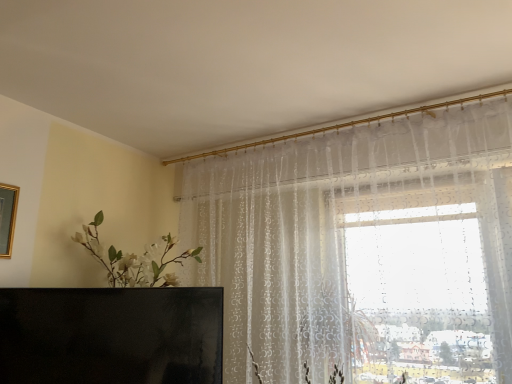
What do you see at coordinates (111, 335) in the screenshot?
I see `black glossy tv at lower left` at bounding box center [111, 335].

The image size is (512, 384). Identify the location of black glossy tv at lower left. (111, 335).

Measure the distance between point (191, 377) and camera.

Point (191, 377) is 2.14 meters from camera.

Image resolution: width=512 pixels, height=384 pixels. Describe the element at coordinates (7, 217) in the screenshot. I see `gold-framed mirror at upper left` at that location.

What is the approximate width of gold-framed mirror at upper left?

The width of gold-framed mirror at upper left is 1.58 inches.

The width and height of the screenshot is (512, 384). I want to click on gold-framed mirror at upper left, so click(x=7, y=217).

This screenshot has height=384, width=512. I want to click on black glossy tv at lower left, so click(111, 335).

Which is more to the right, black glossy tv at lower left or gold-framed mirror at upper left?

black glossy tv at lower left is more to the right.

Is black glossy tv at lower left behind gold-framed mirror at upper left?

No, it is not.

Does point (111, 377) lie in front of point (11, 212)?

That is True.

From the image's perspective, is black glossy tv at lower left below gold-framed mirror at upper left?

Indeed, from the image's perspective, black glossy tv at lower left is shown beneath gold-framed mirror at upper left.

From a real-world perspective, which object stands above the other?

In real-world perspective, gold-framed mirror at upper left is above.

Does black glossy tv at lower left have a greater width compared to gold-framed mirror at upper left?

Yes, black glossy tv at lower left is wider than gold-framed mirror at upper left.

Is black glossy tv at lower left taller than gold-framed mirror at upper left?

Indeed, black glossy tv at lower left has a greater height compared to gold-framed mirror at upper left.

Looking at the image, does black glossy tv at lower left seem bigger or smaller compared to gold-framed mirror at upper left?

black glossy tv at lower left is bigger than gold-framed mirror at upper left.

Can we say black glossy tv at lower left lies outside gold-framed mirror at upper left?

That's correct, black glossy tv at lower left is outside of gold-framed mirror at upper left.

Are black glossy tv at lower left and gold-framed mirror at upper left located far from each other?

No.

Is black glossy tv at lower left aimed at gold-framed mirror at upper left?

No, black glossy tv at lower left is not facing towards gold-framed mirror at upper left.

Where is `picture frame above the black glossy tv at lower left (from a real-world perspective)`? Image resolution: width=512 pixels, height=384 pixels. picture frame above the black glossy tv at lower left (from a real-world perspective) is located at coordinates click(x=7, y=217).

Which is more to the left, gold-framed mirror at upper left or black glossy tv at lower left?

Positioned to the left is gold-framed mirror at upper left.

Is gold-framed mirror at upper left positioned in front of black glossy tv at lower left?

No, it is not.

Between point (7, 246) and point (170, 369), which one is positioned in front?

The point (7, 246) is closer.

From the image's perspective, between gold-framed mirror at upper left and black glossy tv at lower left, which one is located above?

gold-framed mirror at upper left is shown above in the image.

From the picture: From a real-world perspective, is gold-framed mirror at upper left over black glossy tv at lower left?

Indeed, from a real-world perspective, gold-framed mirror at upper left stands above black glossy tv at lower left.

Can you confirm if gold-framed mirror at upper left is thinner than black glossy tv at lower left?

Indeed, gold-framed mirror at upper left has a lesser width compared to black glossy tv at lower left.

From their relative heights in the image, would you say gold-framed mirror at upper left is taller or shorter than black glossy tv at lower left?

gold-framed mirror at upper left is shorter than black glossy tv at lower left.

Can you confirm if gold-framed mirror at upper left is bigger than black glossy tv at lower left?

Actually, gold-framed mirror at upper left might be smaller than black glossy tv at lower left.

Is gold-framed mirror at upper left spatially inside black glossy tv at lower left, or outside of it?

gold-framed mirror at upper left is not enclosed by black glossy tv at lower left.

Is there a large distance between gold-framed mirror at upper left and black glossy tv at lower left?

They are positioned close to each other.

Looking at this image, is gold-framed mirror at upper left positioned with its back to black glossy tv at lower left?

gold-framed mirror at upper left does not have its back to black glossy tv at lower left.

Find the location of a particular element. furniture in front of the gold-framed mirror at upper left is located at coordinates (111, 335).

In order to click on furniture in front of the gold-framed mirror at upper left in this screenshot , I will do `click(111, 335)`.

The height and width of the screenshot is (384, 512). Identify the location of furniture below the gold-framed mirror at upper left (from a real-world perspective). (111, 335).